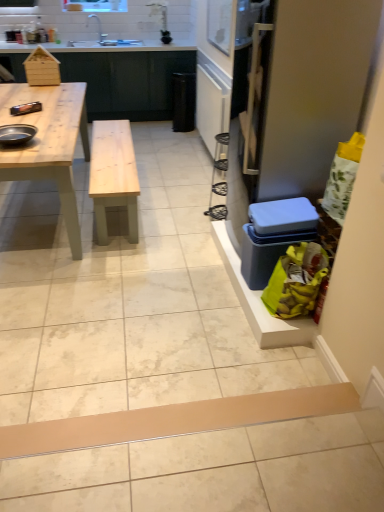
The width and height of the screenshot is (384, 512). I want to click on vacant area situated below shiny black pan at left (from a real-world perspective), so click(x=17, y=137).